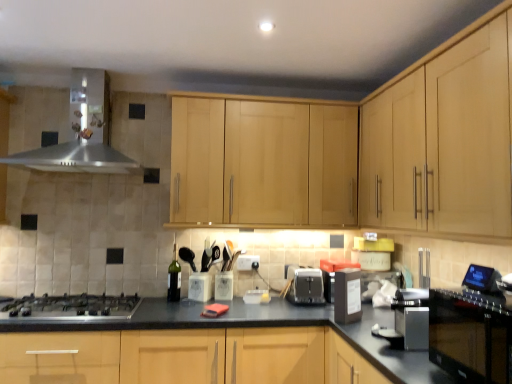
Image resolution: width=512 pixels, height=384 pixels. What are the coordinates of `free space in front of satin silver toaster at center, marked as the 2th appliance in a front-to-back arrangement` in the screenshot? It's located at (300, 308).